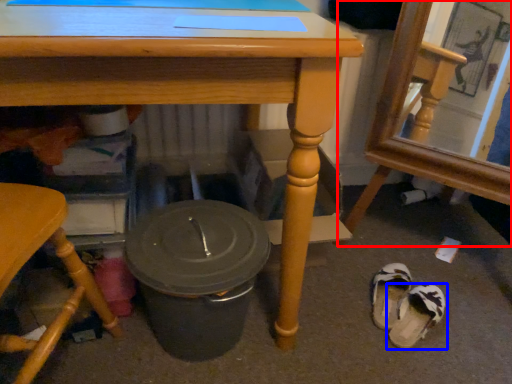
Question: Which object is further to the camera taking this photo, chair (highlighted by a red box) or footwear (highlighted by a blue box)?

Choices:
 (A) chair
 (B) footwear

Answer: (B)